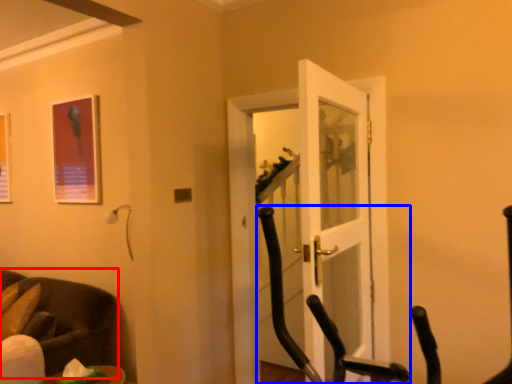
Question: Which point is closer to the camera, chair (highlighted by a red box) or rocking chair (highlighted by a blue box)?

Choices:
 (A) chair
 (B) rocking chair

Answer: (B)